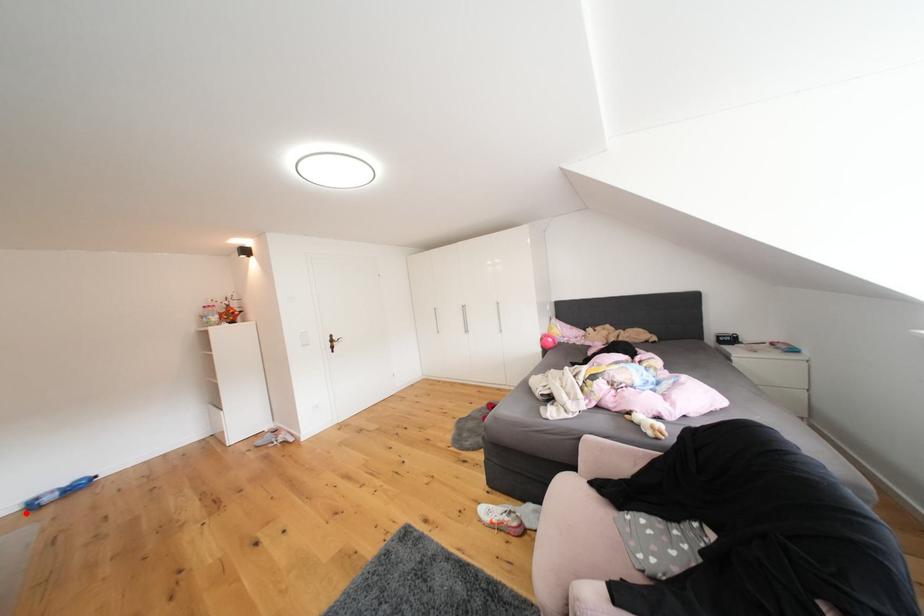
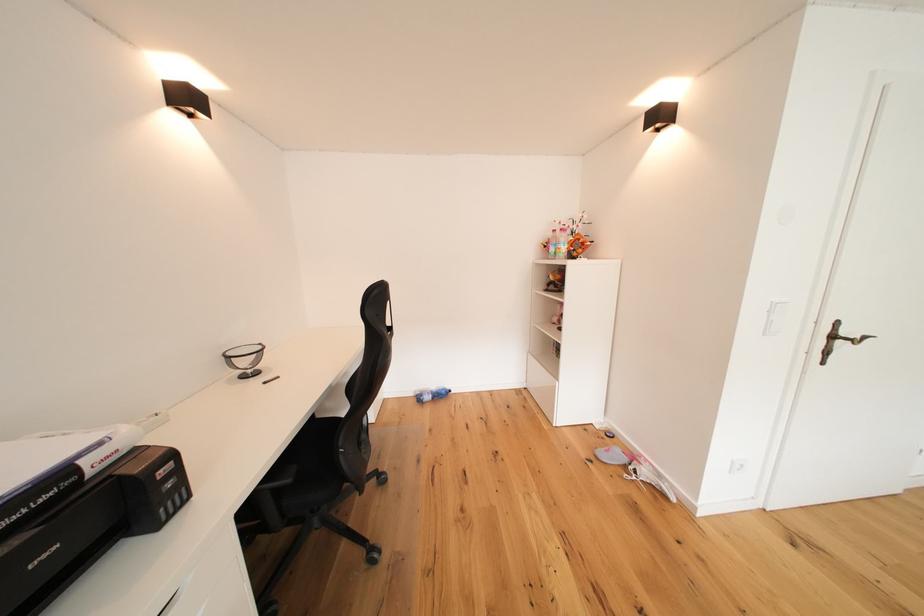
In the second image, find the point that corresponds to the highlighted location in the first image.

(421, 399)